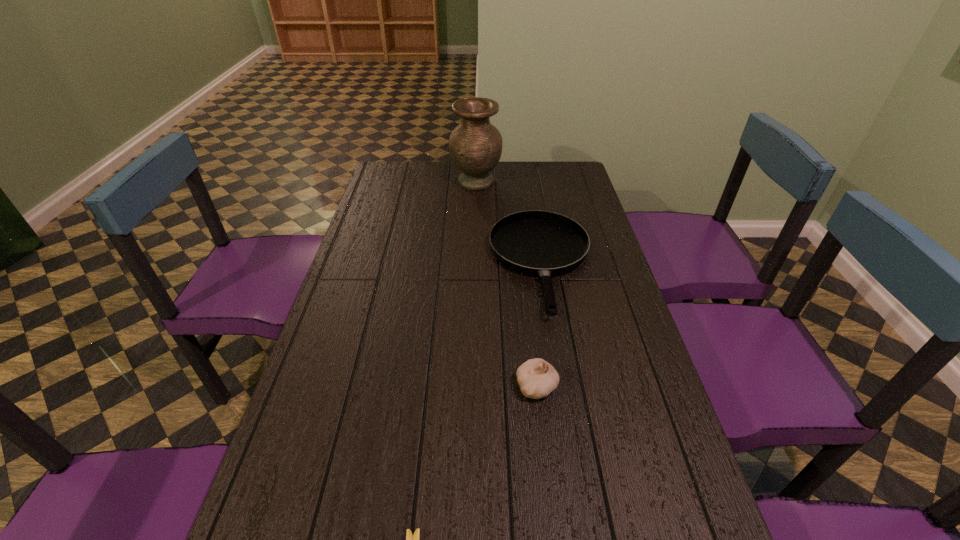
This screenshot has width=960, height=540. I want to click on vase, so coord(475,145).

Locate an element on the screen. This screenshot has height=540, width=960. the tallest object is located at coordinates (475, 145).

You are a GUI agent. You are given a task and a screenshot of the screen. Output one action in this format:
    pyautogui.click(x=<x>, y=<y>)
    Task: Click on the third farthest object
    This screenshot has height=540, width=960.
    Given the screenshot: What is the action you would take?
    pyautogui.click(x=537, y=378)

Find the location of a particular element. The image size is (960, 540). the second tallest object is located at coordinates (537, 378).

What are the coordinates of `the third tallest object` in the screenshot? It's located at [540, 243].

This screenshot has width=960, height=540. What are the coordinates of `frying pan` in the screenshot? It's located at (540, 243).

Image resolution: width=960 pixels, height=540 pixels. Identify the location of free space located 0.170m on the front of the farthest object. (475, 219).

Locate an element on the screen. The width and height of the screenshot is (960, 540). vacant space situated on the left of the garlic is located at coordinates (415, 386).

This screenshot has width=960, height=540. Find the location of `vacant space located on the handle side of the second shortest object`. vacant space located on the handle side of the second shortest object is located at coordinates (572, 455).

Locate an element on the screen. This screenshot has width=960, height=540. object that is at the far edge is located at coordinates pyautogui.click(x=475, y=145).